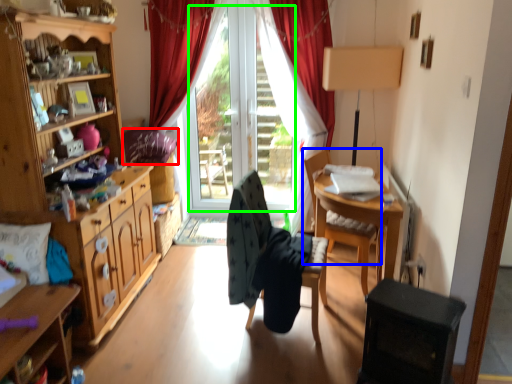
Question: Which is nearer to the pillow (highlighted by a red box)? chair (highlighted by a blue box) or window screen (highlighted by a green box).

Choices:
 (A) chair
 (B) window screen

Answer: (B)